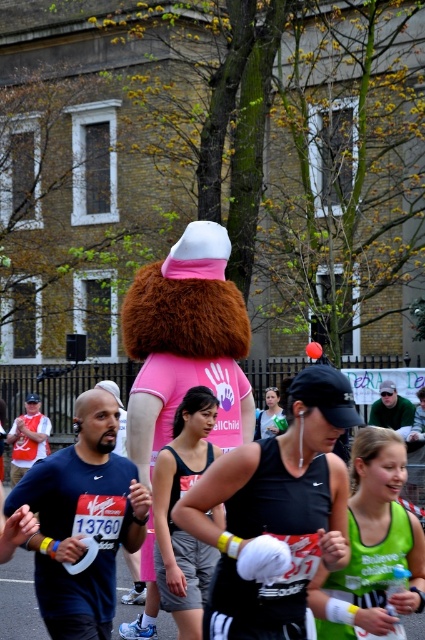
Question: Considering the real-world distances, which object is closest to the green matte tank top at center?

Choices:
 (A) dark blue athletic shirt at center
 (B) pink furry mascot at center
 (C) black matte tank top at center

Answer: (C)

Question: Among these objects, which one is farthest from the camera?

Choices:
 (A) dark blue athletic shirt at center
 (B) black matte tank top at center

Answer: (A)

Question: Is black matte tank top at center behind dark blue athletic shirt at center?

Choices:
 (A) no
 (B) yes

Answer: (A)

Question: Is pink furry mascot at center to the left of dark blue athletic shirt at center from the viewer's perspective?

Choices:
 (A) no
 (B) yes

Answer: (A)

Question: Which object appears farthest from the camera in this image?

Choices:
 (A) pink furry mascot at center
 (B) black matte tank top at center
 (C) dark blue athletic shirt at center
 (D) green matte tank top at center

Answer: (A)

Question: Does black matte tank top at center have a greater width compared to green matte tank top at center?

Choices:
 (A) yes
 (B) no

Answer: (A)